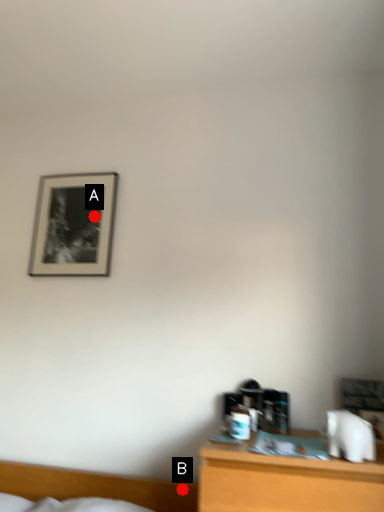
Question: Two points are circled on the image, labeled by A and B beside each circle. Among these points, which one is farthest from the camera?

Choices:
 (A) A is further
 (B) B is further

Answer: (A)